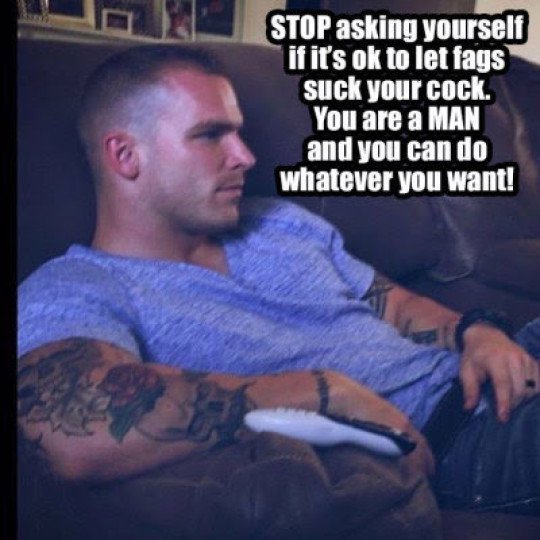
This screenshot has width=540, height=540. In order to click on picture frames in this screenshot , I will do `click(89, 19)`, `click(102, 17)`, `click(162, 16)`, `click(235, 23)`, `click(43, 19)`.